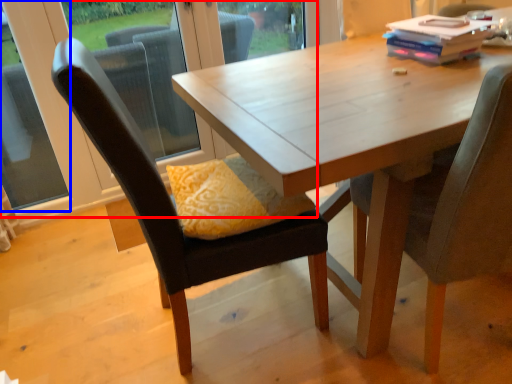
Question: Which object is further to the camera taking this photo, window frame (highlighted by a red box) or window (highlighted by a blue box)?

Choices:
 (A) window frame
 (B) window

Answer: (A)